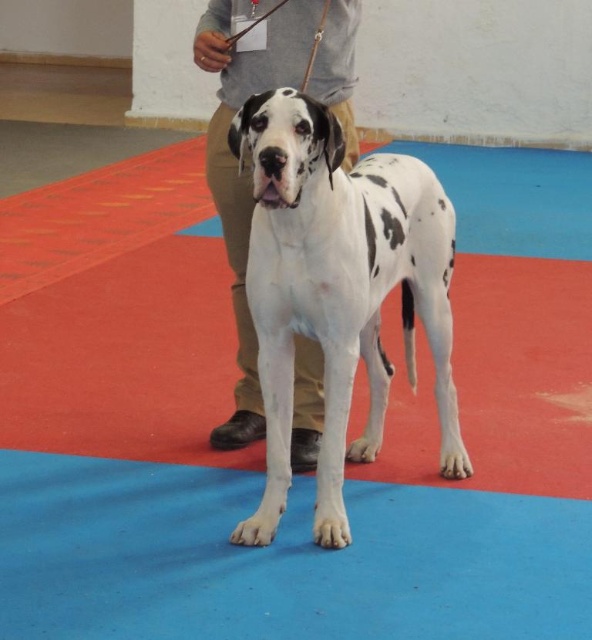
Question: Which of the following is the farthest from the observer?

Choices:
 (A) (440, 349)
 (B) (215, 8)

Answer: (A)

Question: Can you confirm if white-spotted fur dog at center is thinner than khaki pants at center?

Choices:
 (A) no
 (B) yes

Answer: (A)

Question: Can you confirm if white-spotted fur dog at center is positioned below khaki pants at center?

Choices:
 (A) no
 (B) yes

Answer: (B)

Question: Among these points, which one is nearest to the camera?

Choices:
 (A) (278, 276)
 (B) (246, 355)

Answer: (A)

Question: Does white-spotted fur dog at center appear on the left side of khaki pants at center?

Choices:
 (A) no
 (B) yes

Answer: (A)